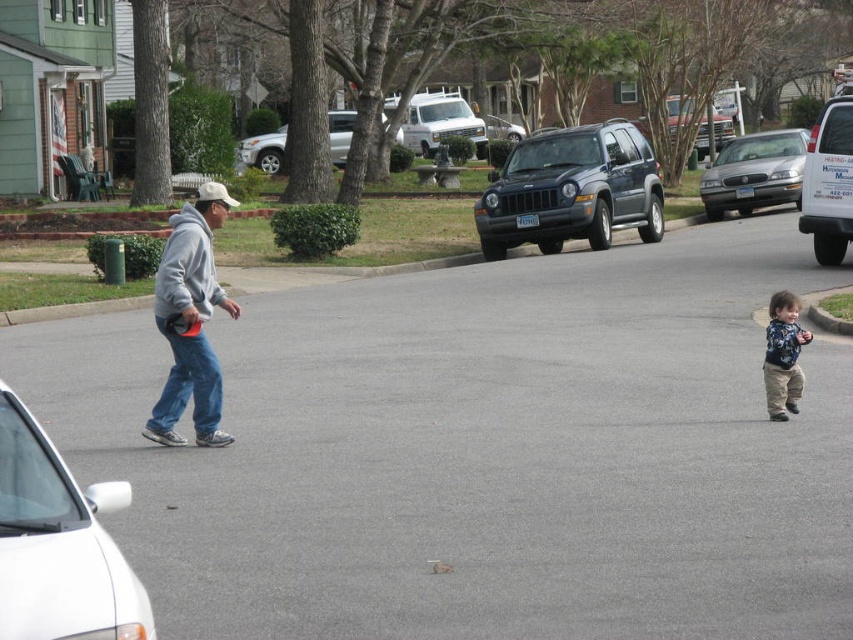
Question: Can you confirm if dark gray matte suv at center is smaller than silver metallic suv at upper center?

Choices:
 (A) no
 (B) yes

Answer: (B)

Question: Among these points, which one is farthest from the camera?

Choices:
 (A) (270, 161)
 (B) (820, 211)
 (C) (747, 205)
 (D) (585, 202)

Answer: (A)

Question: Can you confirm if white glossy car at lower left is smaller than blue patterned shirt at right?

Choices:
 (A) yes
 (B) no

Answer: (B)

Question: Which point is closer to the camera taking this photo?

Choices:
 (A) (779, 385)
 (B) (137, 634)

Answer: (B)

Question: Can you confirm if white glossy car at lower left is thinner than silver metallic sedan at right?

Choices:
 (A) yes
 (B) no

Answer: (A)

Question: Which of the following is the farthest from the observer?

Choices:
 (A) silver metallic suv at upper center
 (B) gray fleece hoodie at left
 (C) white glossy car at lower left
 (D) blue patterned shirt at right

Answer: (A)